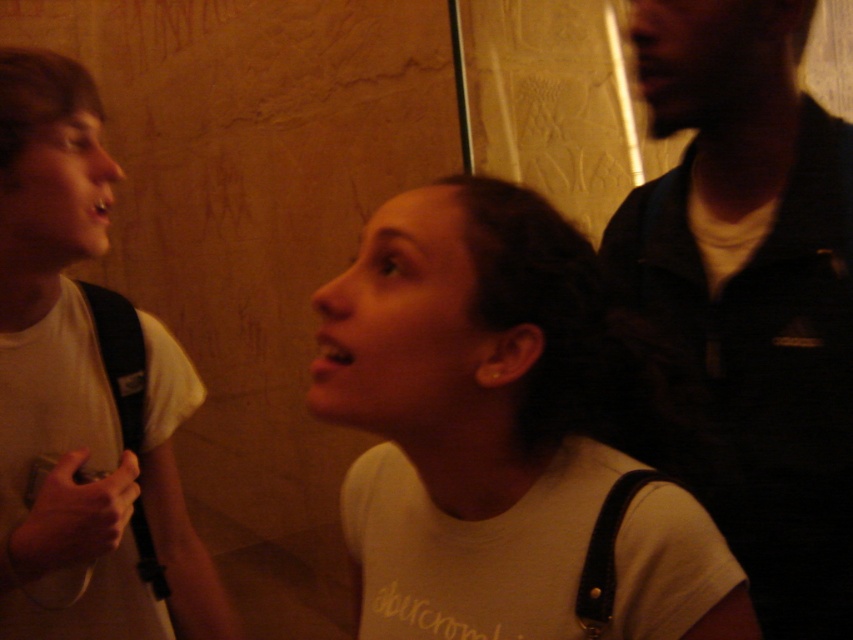
Is white matte shirt at center to the right of dark blue shirt at upper right from the viewer's perspective?

In fact, white matte shirt at center is to the left of dark blue shirt at upper right.

Measure the distance between white matte shirt at center and camera.

The distance of white matte shirt at center from camera is 61.92 centimeters.

In order to click on white matte shirt at center in this screenshot , I will do `click(467, 412)`.